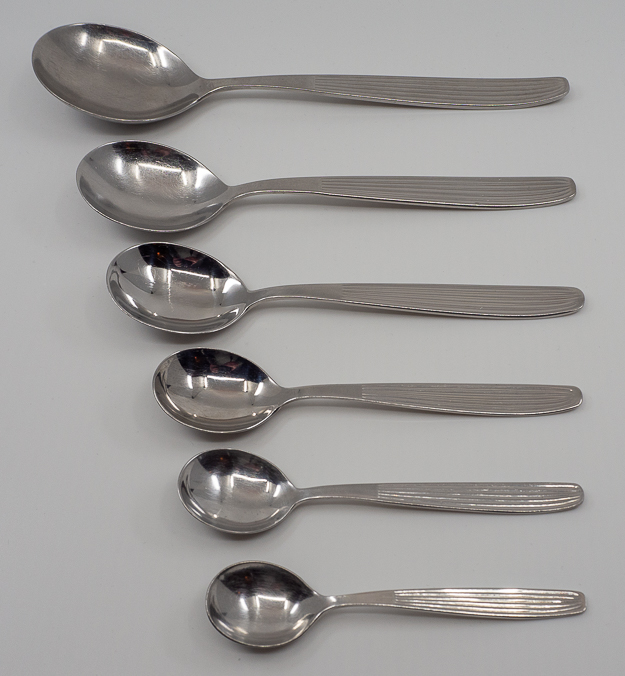
This screenshot has height=676, width=625. Find the location of `spoon ladles`. spoon ladles is located at coordinates (245, 606), (222, 498), (208, 377), (185, 306), (158, 180), (128, 78).